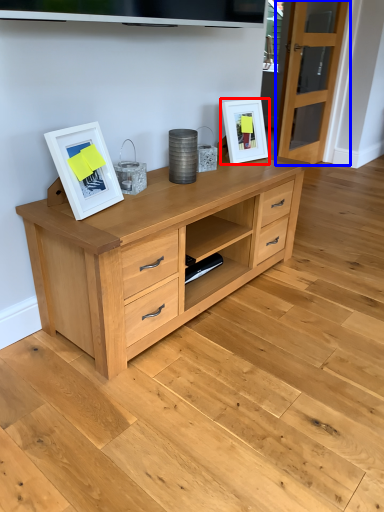
Question: Which object is further to the camera taking this photo, picture frame (highlighted by a red box) or glass door (highlighted by a blue box)?

Choices:
 (A) picture frame
 (B) glass door

Answer: (B)